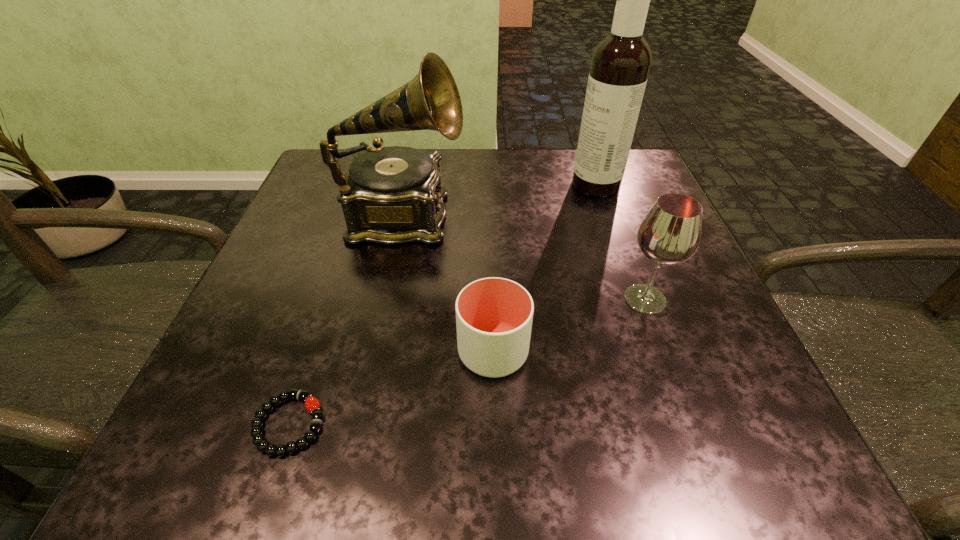
Find the location of a particular element. dishwasher detergent at the right edge is located at coordinates (620, 65).

You are a GUI agent. You are given a task and a screenshot of the screen. Output one action in this format:
    pyautogui.click(x=<x>, y=<y>)
    Task: Click on the wineglass positioned at the right edge
    The width and height of the screenshot is (960, 540).
    Given the screenshot: What is the action you would take?
    pyautogui.click(x=670, y=233)

Find the location of a particular element. The width and height of the screenshot is (960, 540). object present at the far left corner is located at coordinates (391, 195).

I want to click on object at the near left corner, so click(312, 404).

Identify the location of object that is at the far right corner. coord(620,65).

Image resolution: width=960 pixels, height=540 pixels. Find the location of `free region at the far edge of the desktop`. free region at the far edge of the desktop is located at coordinates (469, 166).

The width and height of the screenshot is (960, 540). In the image, there is a desktop. Find the location of `vacant space at the near edge`. vacant space at the near edge is located at coordinates (513, 463).

This screenshot has width=960, height=540. Find the location of `free space at the left edge of the desktop`. free space at the left edge of the desktop is located at coordinates (324, 280).

Locate an element on the screen. The height and width of the screenshot is (540, 960). vacant space at the right edge of the desktop is located at coordinates (700, 274).

This screenshot has height=540, width=960. In order to click on free region at the far left corner of the desktop in this screenshot , I will do `click(318, 170)`.